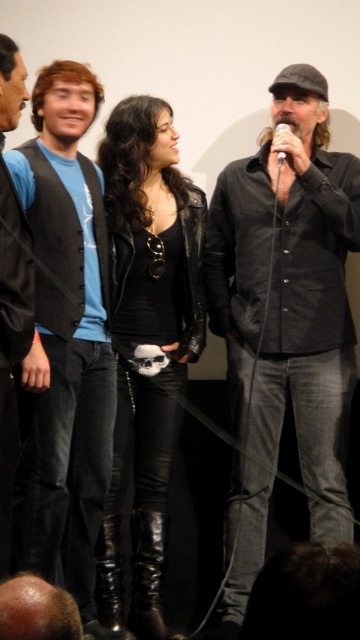
Is dark gray shirt at center further to the viewer compared to black leather jacket at center?

That is False.

The width and height of the screenshot is (360, 640). Describe the element at coordinates (284, 310) in the screenshot. I see `dark gray shirt at center` at that location.

Locate an element on the screen. dark gray shirt at center is located at coordinates (284, 310).

Is black leather jacket at center thinner than black leather vest at left?

In fact, black leather jacket at center might be wider than black leather vest at left.

Can you confirm if black leather jacket at center is smaller than black leather vest at left?

Actually, black leather jacket at center might be larger than black leather vest at left.

Is point (136, 250) behind point (16, 99)?

Yes, point (136, 250) is farther from viewer.

Identify the location of black leather jacket at center. (146, 339).

Which is more to the left, dark gray shirt at center or matte black vest at left?

Positioned to the left is matte black vest at left.

Is point (299, 141) positioned after point (34, 560)?

Yes.

Find the location of a particular element. The width and height of the screenshot is (360, 640). dark gray shirt at center is located at coordinates (284, 310).